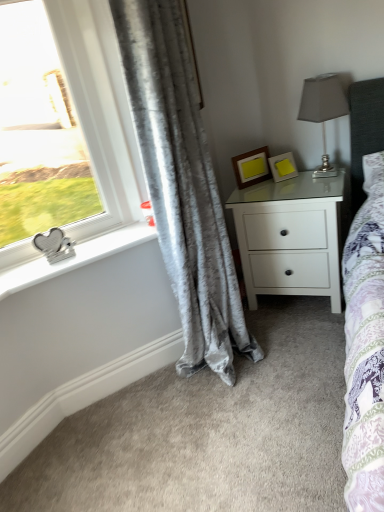
The image size is (384, 512). I want to click on free space in front of wooden picture frame at center, which is counted as the second picture frame, starting from the right, so click(x=272, y=191).